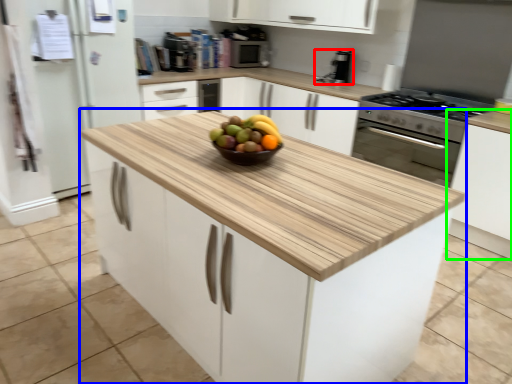
Question: Considering the real-world distances, which object is closest to kitchen appliance (highlighted by a red box)? cabinetry (highlighted by a blue box) or cabinetry (highlighted by a green box).

Choices:
 (A) cabinetry
 (B) cabinetry

Answer: (B)